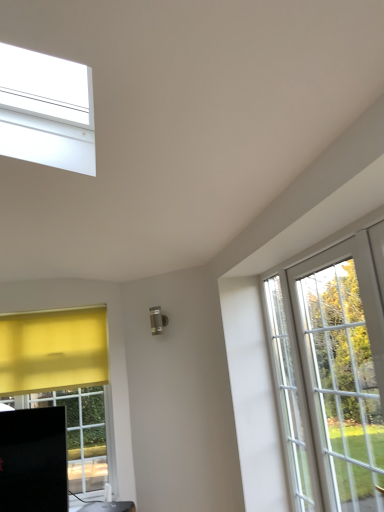
Question: Would you say white glass screen door at right is to the left or to the right of matte black router at lower left in the picture?

Choices:
 (A) right
 (B) left

Answer: (A)

Question: From their relative heights in the image, would you say white glass screen door at right is taller or shorter than matte black router at lower left?

Choices:
 (A) short
 (B) tall

Answer: (B)

Question: Is white glass screen door at right spatially inside matte black router at lower left, or outside of it?

Choices:
 (A) inside
 (B) outside

Answer: (B)

Question: Based on their positions, is matte black router at lower left located to the left or right of white glass screen door at right?

Choices:
 (A) left
 (B) right

Answer: (A)

Question: Is point (109, 507) closer or farther from the camera than point (309, 420)?

Choices:
 (A) closer
 (B) farther

Answer: (B)

Question: Is matte black router at lower left spatially inside white glass screen door at right, or outside of it?

Choices:
 (A) inside
 (B) outside

Answer: (B)

Question: In terms of height, does matte black router at lower left look taller or shorter compared to white glass screen door at right?

Choices:
 (A) tall
 (B) short

Answer: (B)